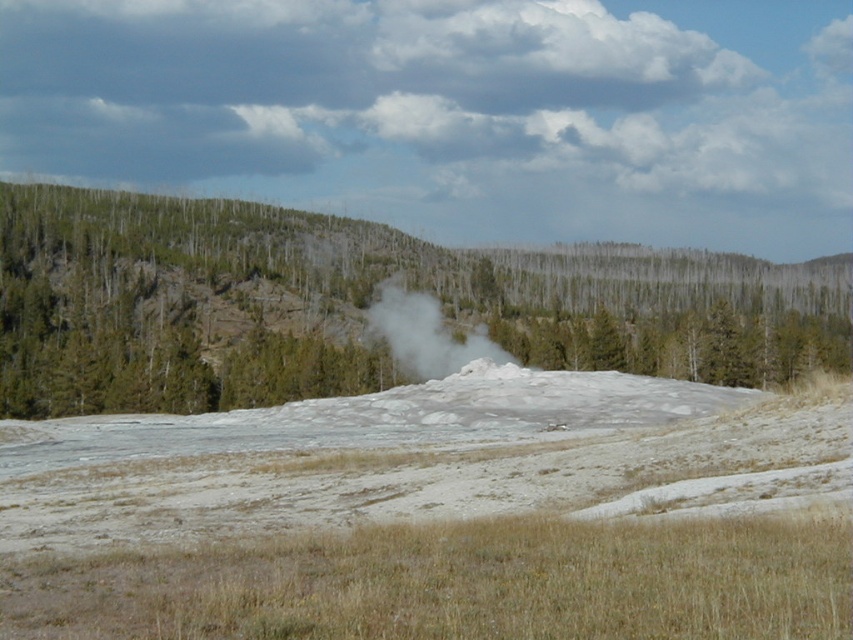
Question: Which of the following is the closest to the observer?

Choices:
 (A) (6, 305)
 (B) (463, 369)

Answer: (B)

Question: Observing the image, what is the correct spatial positioning of green textured tree at center in reference to white steam at center?

Choices:
 (A) below
 (B) above

Answer: (B)

Question: Does green textured tree at center appear on the left side of white steam at center?

Choices:
 (A) yes
 (B) no

Answer: (A)

Question: Is green textured tree at center wider than white steam at center?

Choices:
 (A) no
 (B) yes

Answer: (B)

Question: Among these objects, which one is nearest to the camera?

Choices:
 (A) green textured tree at center
 (B) white steam at center

Answer: (B)

Question: Which object appears closest to the camera in this image?

Choices:
 (A) green textured tree at center
 (B) white steam at center

Answer: (B)